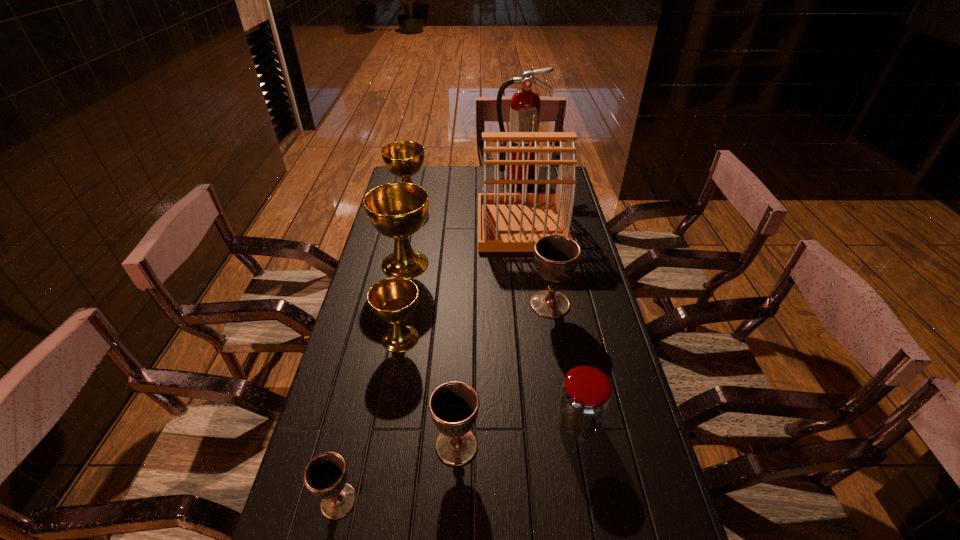
Identify the location of red fire extinguisher. The width and height of the screenshot is (960, 540). (525, 103).

Where is `the farthest object`? the farthest object is located at coordinates (525, 103).

This screenshot has width=960, height=540. Find the location of `birdcage`. birdcage is located at coordinates (507, 222).

Find the location of a particular element. The width and height of the screenshot is (960, 540). the biggest gold chalice is located at coordinates (397, 210).

Locate an element on the screen. the third tallest object is located at coordinates (397, 210).

This screenshot has width=960, height=540. I want to click on the farthest chalice, so 404,159.

This screenshot has height=540, width=960. Find the location of `the farthest gold chalice`. the farthest gold chalice is located at coordinates [x=404, y=159].

You are a GUI agent. You are given a task and a screenshot of the screen. Output one action in this format:
    pyautogui.click(x=<x>, y=<y>)
    Task: Click on the rightmost brown chalice
    The image size is (960, 540).
    Given the screenshot: What is the action you would take?
    pyautogui.click(x=556, y=257)

This screenshot has height=540, width=960. I want to click on the farthest brown chalice, so click(x=556, y=257).

Find the location of `the second smallest brown chalice`. the second smallest brown chalice is located at coordinates (453, 406).